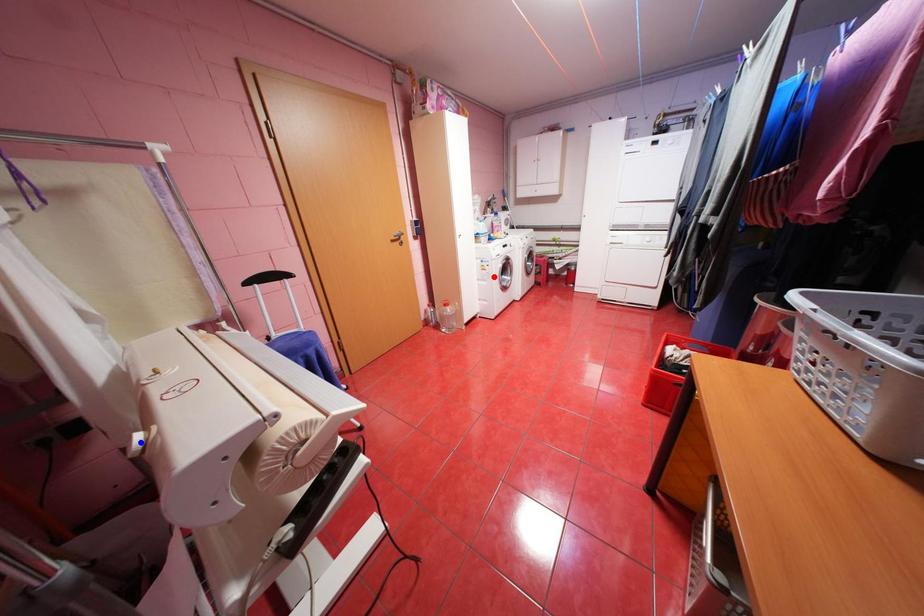
Question: Two points are marked on the image. Which point is closer to the camera?

Choices:
 (A) Blue point is closer.
 (B) Red point is closer.

Answer: (A)